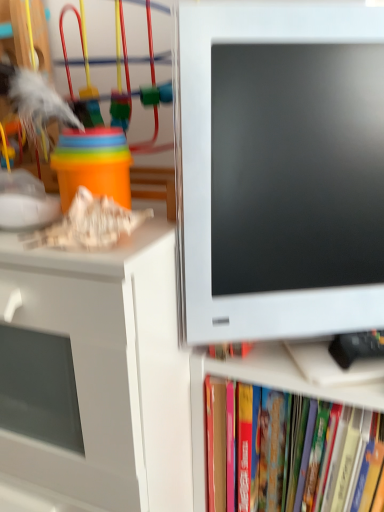
Question: Is hardcover book at lower right bigger than satin white monitor at right?

Choices:
 (A) yes
 (B) no

Answer: (A)

Question: From the image's perspective, is hardcover book at lower right over satin white monitor at right?

Choices:
 (A) no
 (B) yes

Answer: (A)

Question: Does hardcover book at lower right have a smaller size compared to satin white monitor at right?

Choices:
 (A) no
 (B) yes

Answer: (A)

Question: Is hardcover book at lower right taller than satin white monitor at right?

Choices:
 (A) yes
 (B) no

Answer: (B)

Question: Considering the relative sizes of hardcover book at lower right and satin white monitor at right in the image provided, is hardcover book at lower right thinner than satin white monitor at right?

Choices:
 (A) yes
 (B) no

Answer: (B)

Question: Is matte plastic cups at upper left spatially inside white glossy cabinet at left, or outside of it?

Choices:
 (A) inside
 (B) outside

Answer: (B)

Question: From a real-world perspective, is matte plastic cups at upper left above or below white glossy cabinet at left?

Choices:
 (A) above
 (B) below

Answer: (A)

Question: In terms of size, does matte plastic cups at upper left appear bigger or smaller than white glossy cabinet at left?

Choices:
 (A) small
 (B) big

Answer: (A)

Question: Considering the positions of point (84, 160) and point (170, 460), is point (84, 160) closer or farther from the camera than point (170, 460)?

Choices:
 (A) farther
 (B) closer

Answer: (B)

Question: Do you think white glossy cabinet at left is within matte plastic cups at upper left, or outside of it?

Choices:
 (A) inside
 (B) outside

Answer: (B)

Question: In terms of size, does white glossy cabinet at left appear bigger or smaller than matte plastic cups at upper left?

Choices:
 (A) small
 (B) big

Answer: (B)

Question: From the image's perspective, is white glossy cabinet at left positioned above or below matte plastic cups at upper left?

Choices:
 (A) below
 (B) above

Answer: (A)

Question: In terms of height, does white glossy cabinet at left look taller or shorter compared to matte plastic cups at upper left?

Choices:
 (A) tall
 (B) short

Answer: (A)

Question: From their relative heights in the image, would you say satin white monitor at right is taller or shorter than hardcover book at lower right?

Choices:
 (A) tall
 (B) short

Answer: (A)

Question: Is satin white monitor at right to the left or to the right of hardcover book at lower right in the image?

Choices:
 (A) right
 (B) left

Answer: (B)